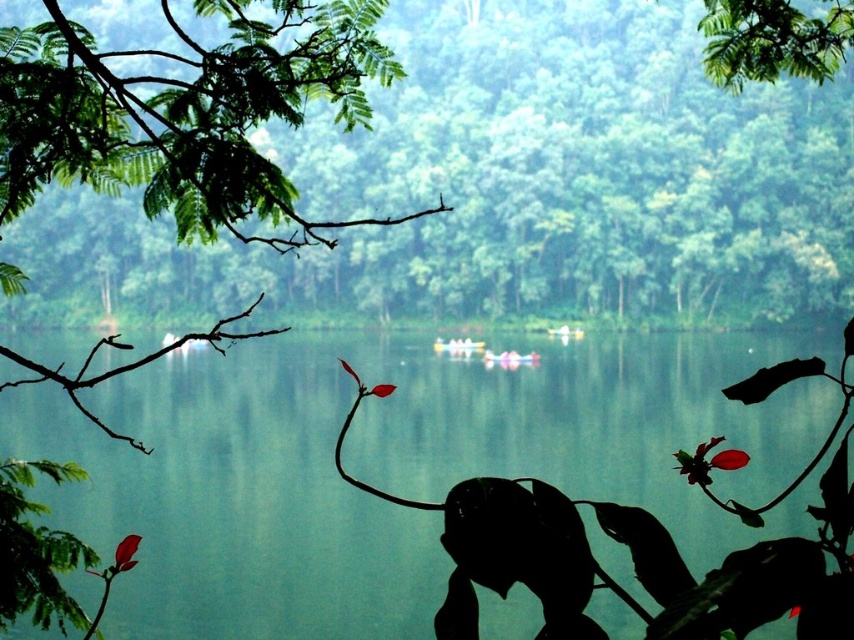
Question: Estimate the real-world distances between objects in this image. Which object is closer to the green smooth water at center?

Choices:
 (A) matte red flower at lower left
 (B) yellow matte boat at center
 (C) brown/rough branch at left
 (D) green leafy tree at upper center

Answer: (D)

Question: Does green smooth water at center lie in front of brown/rough branch at left?

Choices:
 (A) yes
 (B) no

Answer: (A)

Question: Which object appears farthest from the camera in this image?

Choices:
 (A) green leafy tree at upper center
 (B) brown/rough branch at left
 (C) matte red flower at lower left
 (D) green leafy branch at upper left

Answer: (A)

Question: Is the position of brown/rough branch at left less distant than that of yellow plastic boat at center?

Choices:
 (A) no
 (B) yes

Answer: (B)

Question: Observing the image, what is the correct spatial positioning of pink glossy boat at center in reference to yellow matte boat at center?

Choices:
 (A) left
 (B) right

Answer: (A)

Question: Estimate the real-world distances between objects in this image. Which object is farther from the brown/rough branch at left?

Choices:
 (A) yellow matte boat at center
 (B) dark red matte flower at lower right
 (C) yellow plastic boat at center
 (D) pink glossy boat at center

Answer: (B)